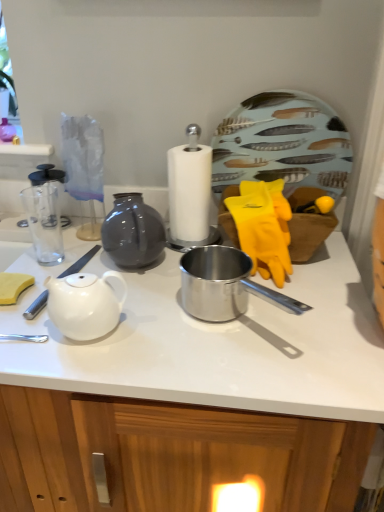
Question: Is white glossy teapot at left shorter than white glossy teapot at center-left?

Choices:
 (A) yes
 (B) no

Answer: (A)

Question: From the image's perspective, is white glossy teapot at left under white glossy teapot at center-left?

Choices:
 (A) no
 (B) yes

Answer: (B)

Question: Considering the relative sizes of white glossy teapot at left and white glossy teapot at center-left in the image provided, is white glossy teapot at left wider than white glossy teapot at center-left?

Choices:
 (A) no
 (B) yes

Answer: (A)

Question: Does white glossy teapot at left have a greater height compared to white glossy teapot at center-left?

Choices:
 (A) yes
 (B) no

Answer: (B)

Question: Does white glossy teapot at left appear on the left side of white glossy teapot at center-left?

Choices:
 (A) no
 (B) yes

Answer: (B)

Question: From the image's perspective, is feather-patterned ceramic plate at upper right above or below white glossy teapot at left?

Choices:
 (A) below
 (B) above

Answer: (B)

Question: Considering the relative positions of feather-patterned ceramic plate at upper right and white glossy teapot at left in the image provided, is feather-patterned ceramic plate at upper right to the left or to the right of white glossy teapot at left?

Choices:
 (A) right
 (B) left

Answer: (A)

Question: From their relative heights in the image, would you say feather-patterned ceramic plate at upper right is taller or shorter than white glossy teapot at left?

Choices:
 (A) tall
 (B) short

Answer: (A)

Question: Considering the positions of feather-patterned ceramic plate at upper right and white glossy teapot at left in the image, is feather-patterned ceramic plate at upper right bigger or smaller than white glossy teapot at left?

Choices:
 (A) small
 (B) big

Answer: (B)

Question: Considering the positions of white glossy teapot at center-left and white glossy teapot at left in the image, is white glossy teapot at center-left taller or shorter than white glossy teapot at left?

Choices:
 (A) short
 (B) tall

Answer: (B)

Question: Based on their sizes in the image, would you say white glossy teapot at center-left is bigger or smaller than white glossy teapot at left?

Choices:
 (A) small
 (B) big

Answer: (B)

Question: Is white glossy teapot at center-left wider or thinner than white glossy teapot at left?

Choices:
 (A) wide
 (B) thin

Answer: (A)

Question: Is white glossy teapot at center-left in front of or behind white glossy teapot at left in the image?

Choices:
 (A) behind
 (B) front

Answer: (B)

Question: Is white glossy teapot at center-left wider or thinner than feather-patterned ceramic plate at upper right?

Choices:
 (A) thin
 (B) wide

Answer: (B)

Question: From a real-world perspective, relative to feather-patterned ceramic plate at upper right, is white glossy teapot at center-left vertically above or below?

Choices:
 (A) below
 (B) above

Answer: (A)